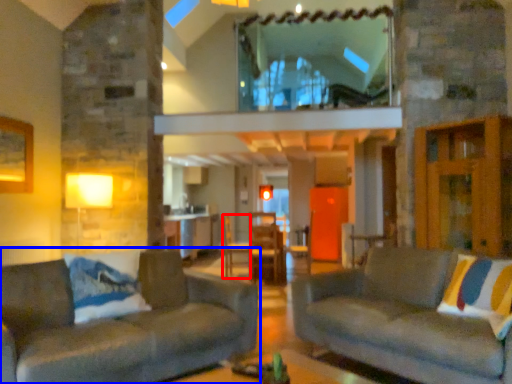
Question: Among these objects, which one is nearest to the camera, armchair (highlighted by a red box) or studio couch (highlighted by a blue box)?

Choices:
 (A) armchair
 (B) studio couch

Answer: (B)